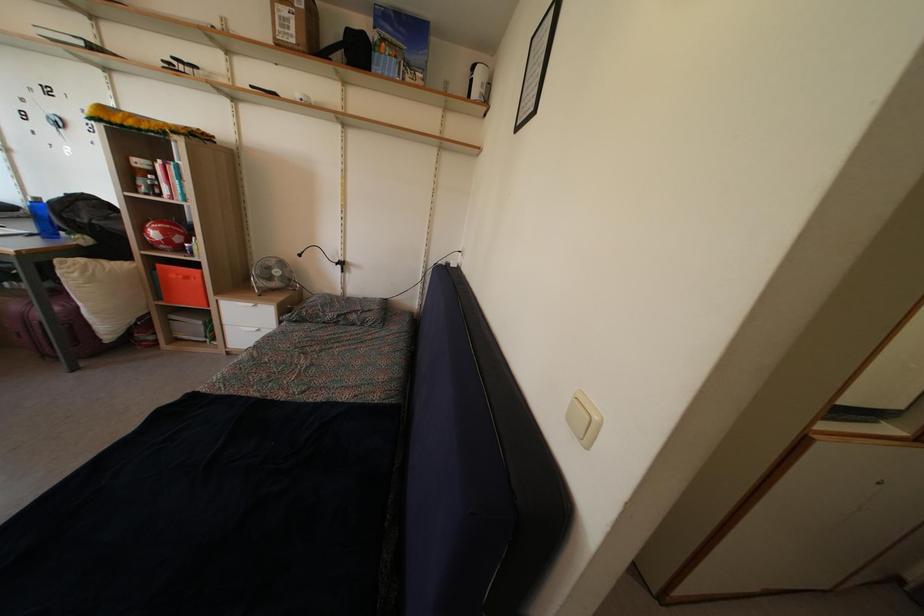
Find the location of `white light switch`. white light switch is located at coordinates (582, 419).